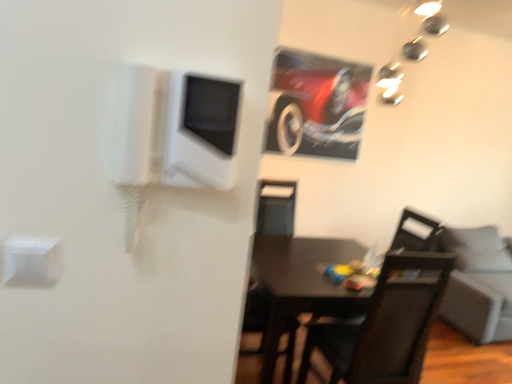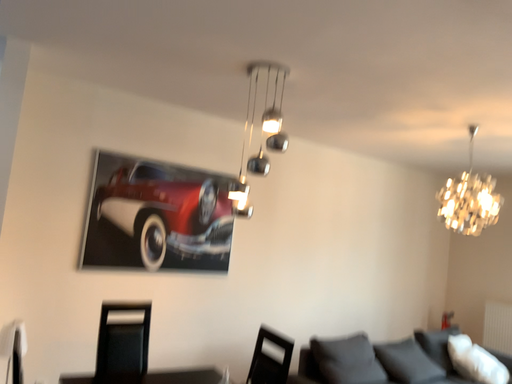
Question: Which way did the camera rotate in the video?

Choices:
 (A) rotated upward
 (B) rotated downward

Answer: (A)